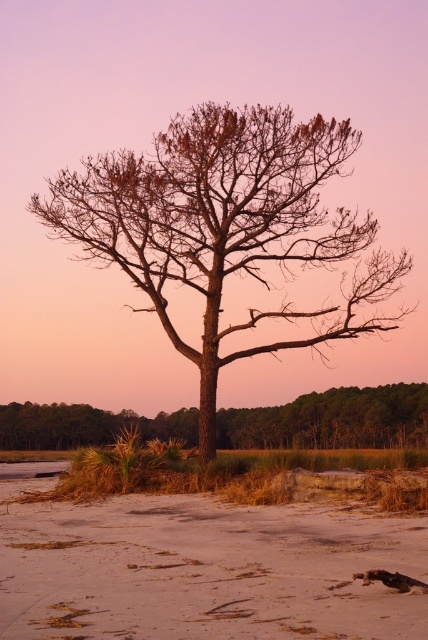
Is bare wood tree at center positioned before brown textured tree at center?

Yes, it is.

Measure the distance between bare wood tree at center and brown textured tree at center.

They are 48.42 feet apart.

The image size is (428, 640). Identify the location of bare wood tree at center. (226, 225).

Does point (401, 618) come closer to viewer compared to point (261, 417)?

Yes, it is.

Is point (104, 524) farther from viewer compared to point (323, 400)?

No, it is in front of (323, 400).

Which is in front, point (119, 570) or point (104, 410)?

Point (119, 570) is more forward.

Where is `sandy beige at lower center`? This screenshot has width=428, height=640. sandy beige at lower center is located at coordinates (202, 570).

Does sandy beige at lower center have a greater height compared to bare wood tree at center?

In fact, sandy beige at lower center may be shorter than bare wood tree at center.

Who is shorter, sandy beige at lower center or bare wood tree at center?

sandy beige at lower center

What are the coordinates of `sandy beige at lower center` in the screenshot? It's located at (202, 570).

The width and height of the screenshot is (428, 640). I want to click on sandy beige at lower center, so click(x=202, y=570).